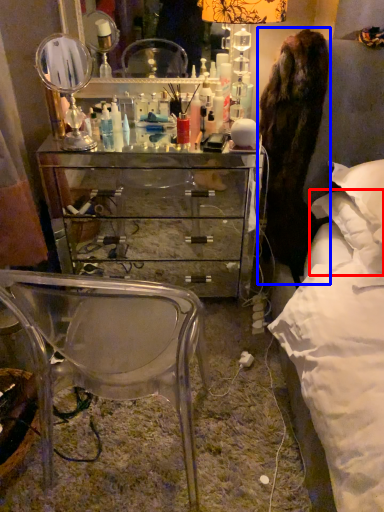
Question: Which of the following is the farthest to the observer, pillow (highlighted by a red box) or fur coat (highlighted by a blue box)?

Choices:
 (A) pillow
 (B) fur coat

Answer: (B)